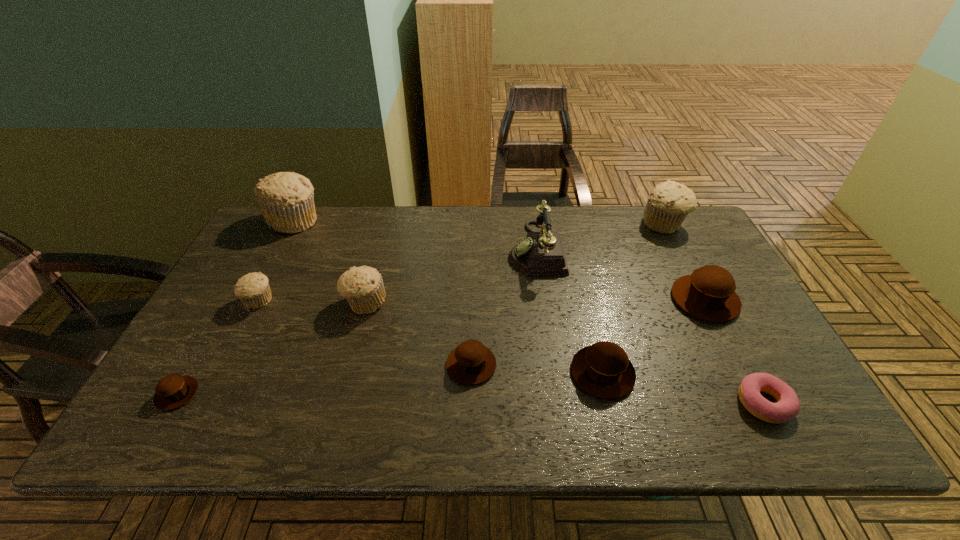
Where is `vacant space located 0.390m on the left of the third smallest beige muffin`? The width and height of the screenshot is (960, 540). vacant space located 0.390m on the left of the third smallest beige muffin is located at coordinates (525, 224).

I want to click on vacant region located on the front of the second smallest beige muffin, so click(x=350, y=360).

Locate an element on the screen. vacant space located 0.240m on the left of the biggest brown muffin is located at coordinates (585, 300).

You are a GUI agent. You are given a task and a screenshot of the screen. Output one action in this format:
    pyautogui.click(x=<x>, y=<y>)
    Task: Click on the vacant space positioned on the right of the smallest beige muffin
    This screenshot has height=540, width=960.
    Given the screenshot: What is the action you would take?
    pyautogui.click(x=410, y=301)

Identify the location of free space located on the right of the second brown muffin from right to left. (732, 373).

The height and width of the screenshot is (540, 960). Identify the location of free spot located on the left of the eighth tallest object. (283, 365).

Locate an element on the screen. The image size is (960, 540). vacant space located on the right of the shortest muffin is located at coordinates (268, 394).

I want to click on free space located 0.180m on the left of the doughnut, so click(657, 403).

Identify the location of telephone located at the far edge. The width and height of the screenshot is (960, 540). click(542, 253).

Where is `muffin present at the near edge`? muffin present at the near edge is located at coordinates (173, 391).